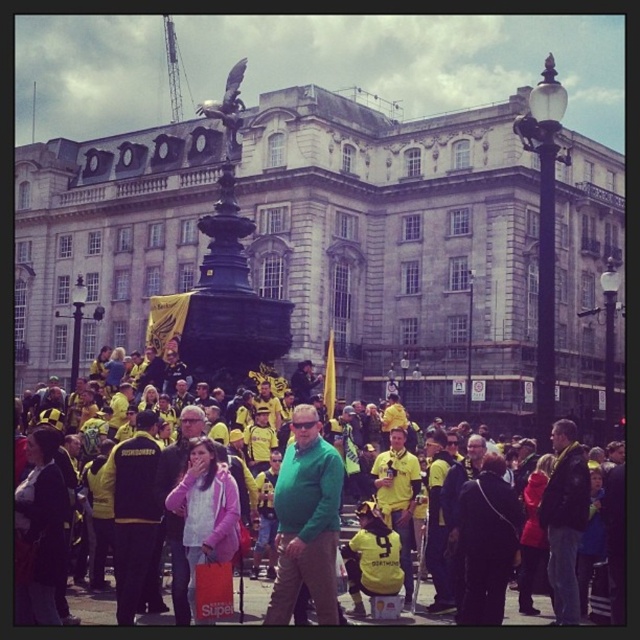
Does green matte shirt at center have a larger size compared to yellow jersey at center?

Incorrect, green matte shirt at center is not larger than yellow jersey at center.

Is green matte shirt at center to the right of yellow jersey at center from the viewer's perspective?

Yes, green matte shirt at center is to the right of yellow jersey at center.

Locate an element on the screen. The image size is (640, 640). green matte shirt at center is located at coordinates [x=307, y=522].

Measure the distance from stone statue at center to pink fabric jacket at center.

A distance of 136.03 feet exists between stone statue at center and pink fabric jacket at center.

Between point (566, 198) and point (180, 500), which one is positioned in front?

Point (180, 500) is in front.

Which is behind, point (381, 134) or point (188, 451)?

The point (381, 134) is more distant.

This screenshot has width=640, height=640. Find the location of `stone statue at center`. stone statue at center is located at coordinates (400, 248).

Is pink fabric jacket at center further to the viewer compared to yellow jersey at center?

That is False.

Is pink fabric jacket at center positioned before yellow jersey at center?

That is True.

Who is more distant from viewer, (188, 484) or (154, 621)?

Point (154, 621)

The height and width of the screenshot is (640, 640). What are the coordinates of `pink fabric jacket at center` in the screenshot? It's located at (205, 512).